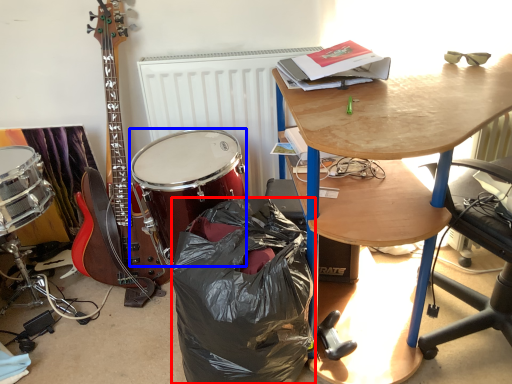
Question: Which object appears closest to the camera in this image, trash bin/can (highlighted by a red box) or drum (highlighted by a blue box)?

Choices:
 (A) trash bin/can
 (B) drum

Answer: (A)